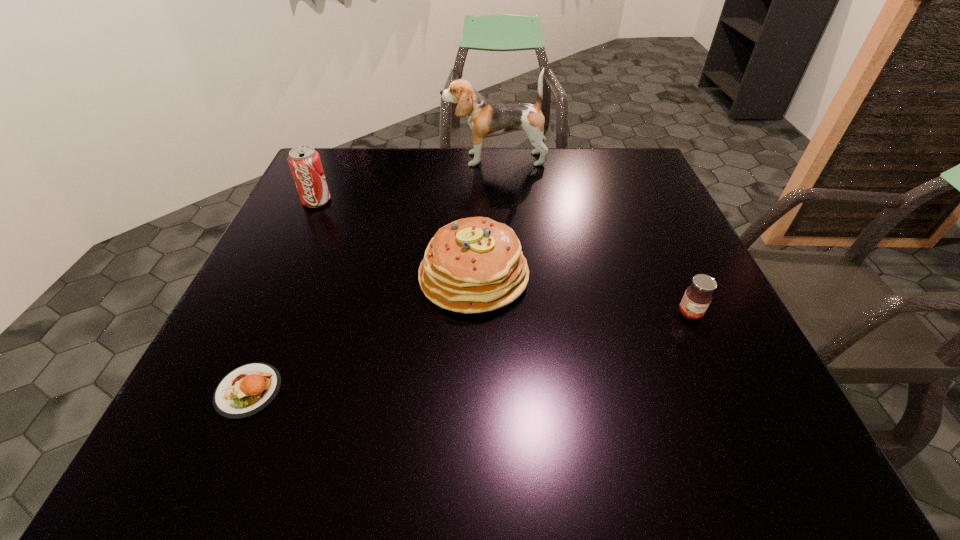
At what (x,y) coordinates should I click in order to perform the action: click on the tallest object. Please return your answer as a coordinate pair (x, y). The width and height of the screenshot is (960, 540). Looking at the image, I should click on (486, 118).

At what (x,y) coordinates should I click in order to perform the action: click on puppy. Please return your answer as a coordinate pair (x, y). The width and height of the screenshot is (960, 540). Looking at the image, I should click on (x=486, y=118).

The image size is (960, 540). What are the coordinates of `soda can` in the screenshot? It's located at (305, 164).

The height and width of the screenshot is (540, 960). I want to click on the fourth nearest object, so click(305, 164).

You are a GUI agent. You are given a task and a screenshot of the screen. Output one action in this format:
    pyautogui.click(x=<x>, y=<y>)
    Task: Click on the third tallest object
    This screenshot has width=960, height=540.
    Given the screenshot: What is the action you would take?
    pyautogui.click(x=472, y=265)

This screenshot has height=540, width=960. Find the location of `the rightmost object`. the rightmost object is located at coordinates (697, 298).

The width and height of the screenshot is (960, 540). I want to click on the second shortest object, so click(x=697, y=298).

Image resolution: width=960 pixels, height=540 pixels. Identify the location of patty (food). (245, 391).

At what (x,y) coordinates should I click in order to perform the action: click on the nearest object. Please return your answer as a coordinate pair (x, y). Looking at the image, I should click on (245, 391).

This screenshot has width=960, height=540. I want to click on free point located at the face of the tallest object, so click(391, 159).